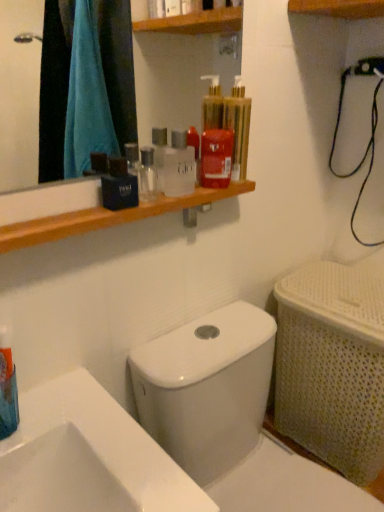
Question: Is black matte bag at upper center, which appears as the fourth mouthwash when viewed from the right, thinner than transparent plastic mouthwash at upper center, the 3th mouthwash viewed from the top?

Choices:
 (A) no
 (B) yes

Answer: (B)

Question: Considering the relative positions of black matte bag at upper center, placed as the fourth mouthwash when sorted from top to bottom, and transparent plastic mouthwash at upper center, the third mouthwash when ordered from bottom to top, in the image provided, is black matte bag at upper center, placed as the fourth mouthwash when sorted from top to bottom, to the left of transparent plastic mouthwash at upper center, the third mouthwash when ordered from bottom to top, from the viewer's perspective?

Choices:
 (A) yes
 (B) no

Answer: (A)

Question: Can you confirm if black matte bag at upper center, which appears as the fourth mouthwash when viewed from the right, is shorter than transparent plastic mouthwash at upper center, the third mouthwash when ordered from bottom to top?

Choices:
 (A) no
 (B) yes

Answer: (B)

Question: From the image's perspective, is black matte bag at upper center, which appears as the fourth mouthwash when viewed from the right, under transparent plastic mouthwash at upper center, which is counted as the 3th mouthwash, starting from the right?

Choices:
 (A) no
 (B) yes

Answer: (B)

Question: From a real-world perspective, is black matte bag at upper center, which appears as the fourth mouthwash when viewed from the right, positioned over transparent plastic mouthwash at upper center, the third mouthwash when ordered from bottom to top, based on gravity?

Choices:
 (A) yes
 (B) no

Answer: (B)

Question: Based on their sizes in the image, would you say black matte bag at upper center, which ranks as the second mouthwash in bottom-to-top order, is bigger or smaller than transparent plastic mouthwash at upper center, the third mouthwash when ordered from bottom to top?

Choices:
 (A) small
 (B) big

Answer: (A)

Question: From a real-world perspective, is black matte bag at upper center, which appears as the fourth mouthwash when viewed from the right, above or below transparent plastic mouthwash at upper center, acting as the 3th mouthwash starting from the left?

Choices:
 (A) below
 (B) above

Answer: (A)

Question: Is black matte bag at upper center, which ranks as the second mouthwash in bottom-to-top order, situated inside transparent plastic mouthwash at upper center, the third mouthwash when ordered from bottom to top, or outside?

Choices:
 (A) inside
 (B) outside

Answer: (B)

Question: Is black matte bag at upper center, the 2th mouthwash from the left, in front of or behind transparent plastic mouthwash at upper center, the 3th mouthwash viewed from the top, in the image?

Choices:
 (A) behind
 (B) front

Answer: (B)

Question: Is translucent plastic mouthwash at upper center, marked as the 5th mouthwash in a left-to-right arrangement, in front of or behind black matte bag at upper center, which ranks as the second mouthwash in bottom-to-top order, in the image?

Choices:
 (A) behind
 (B) front

Answer: (A)

Question: From the image's perspective, is translucent plastic mouthwash at upper center, marked as the 1th mouthwash in a right-to-left arrangement, located above or below black matte bag at upper center, placed as the fourth mouthwash when sorted from top to bottom?

Choices:
 (A) above
 (B) below

Answer: (A)

Question: In terms of size, does translucent plastic mouthwash at upper center, positioned as the 1th mouthwash in top-to-bottom order, appear bigger or smaller than black matte bag at upper center, which ranks as the second mouthwash in bottom-to-top order?

Choices:
 (A) big
 (B) small

Answer: (A)

Question: Is translucent plastic mouthwash at upper center, marked as the 5th mouthwash in a left-to-right arrangement, situated inside black matte bag at upper center, the 2th mouthwash from the left, or outside?

Choices:
 (A) outside
 (B) inside

Answer: (A)

Question: Is white glossy toilet at center taller or shorter than translucent plastic mouthwash at upper center, marked as the 5th mouthwash in a left-to-right arrangement?

Choices:
 (A) short
 (B) tall

Answer: (B)

Question: In terms of width, does white glossy toilet at center look wider or thinner when compared to translucent plastic mouthwash at upper center, positioned as the 1th mouthwash in top-to-bottom order?

Choices:
 (A) thin
 (B) wide

Answer: (B)